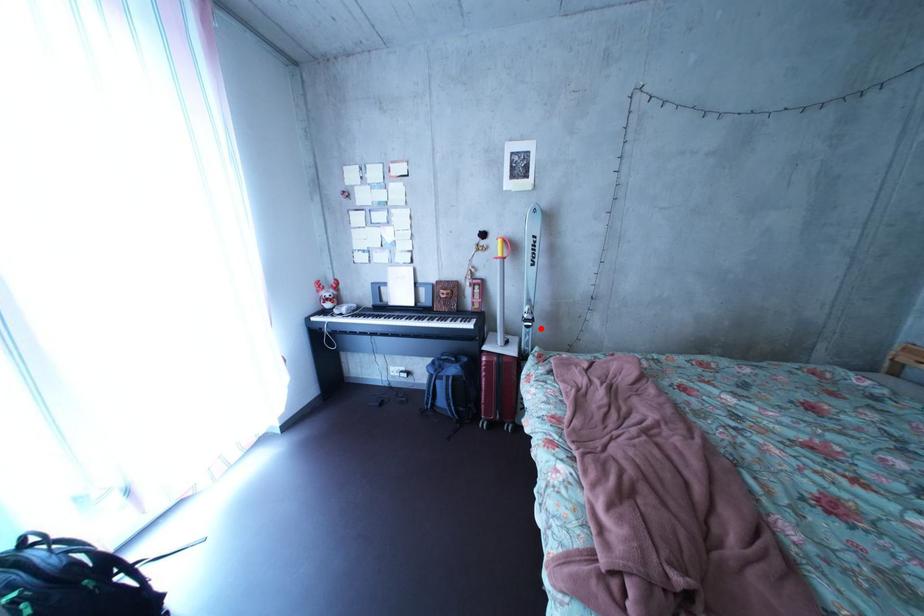
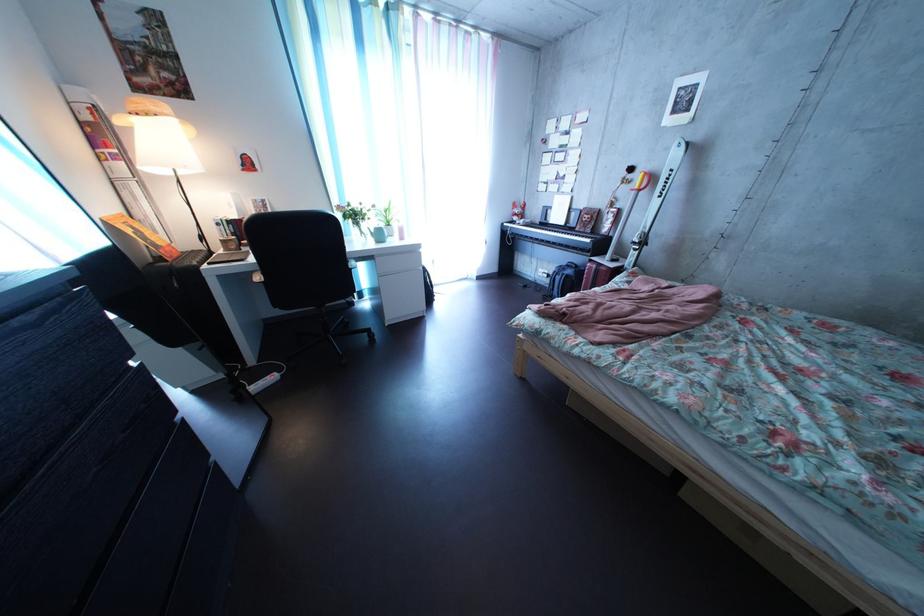
Locate, in the second image, the point that corresponds to the highlighted location in the first image.

(648, 252)